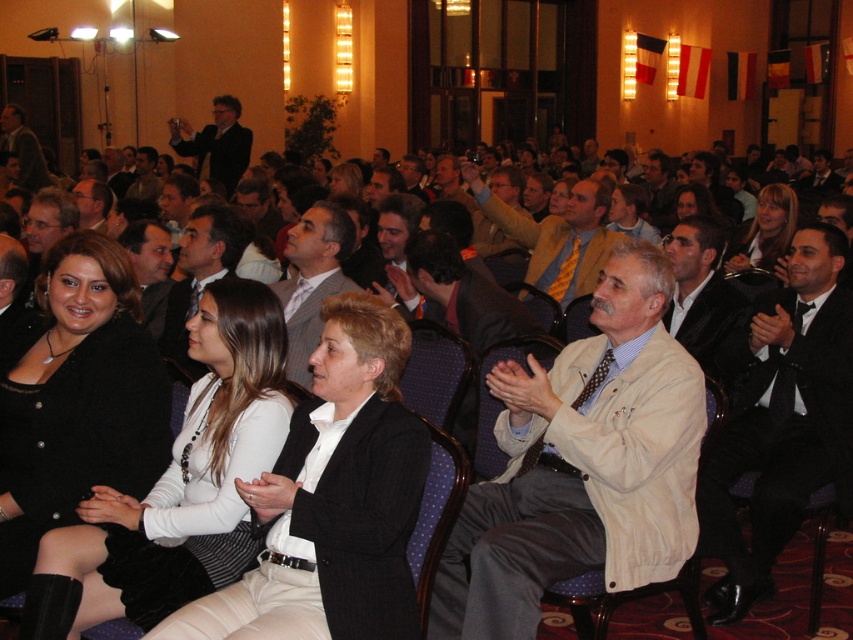
Is beige fabric jacket at center positioned behind black fabric dress at lower left?

That is True.

Can you confirm if beige fabric jacket at center is shorter than black fabric dress at lower left?

In fact, beige fabric jacket at center may be taller than black fabric dress at lower left.

Who is more forward, (444, 586) or (154, 557)?

Point (154, 557) is in front.

I want to click on beige fabric jacket at center, so click(x=581, y=465).

Is black fabric dress at lower left wider than blonde hair at center?

Yes.

Who is taller, black fabric dress at lower left or blonde hair at center?

With more height is black fabric dress at lower left.

Locate an element on the screen. Image resolution: width=853 pixels, height=640 pixels. black fabric dress at lower left is located at coordinates (178, 484).

Does black satin suit at center have a greater width compared to blonde hair at center?

Correct, the width of black satin suit at center exceeds that of blonde hair at center.

Is point (741, 600) positioned behind point (775, 237)?

No, it is in front of (775, 237).

The image size is (853, 640). What are the coordinates of `black satin suit at center` in the screenshot? It's located at (782, 422).

Image resolution: width=853 pixels, height=640 pixels. I want to click on black satin suit at center, so click(x=782, y=422).